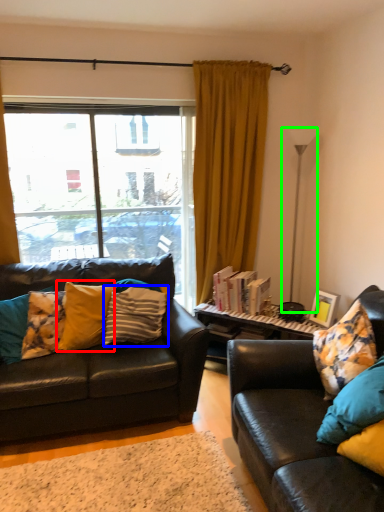
Question: Based on their relative distances, which object is farther from pillow (highlighted by a red box)? Choose from pillow (highlighted by a blue box) and lamp (highlighted by a green box).

Choices:
 (A) pillow
 (B) lamp

Answer: (B)